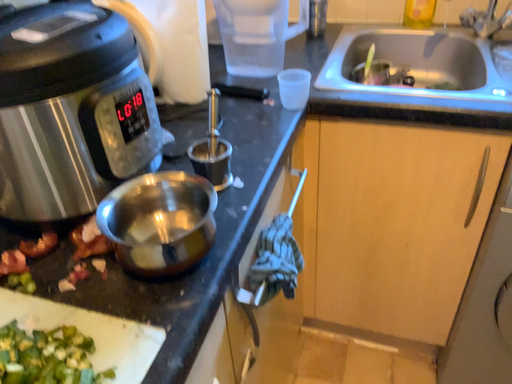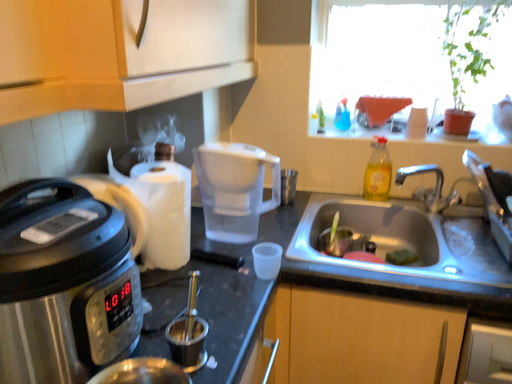
Question: How did the camera likely rotate when shooting the video?

Choices:
 (A) rotated upward
 (B) rotated downward

Answer: (A)